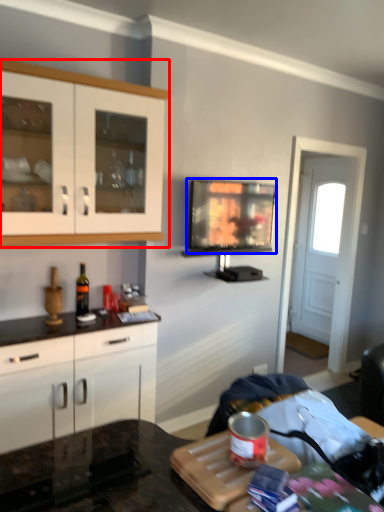
Question: Which point is closer to the camera, cabinetry (highlighted by a red box) or television (highlighted by a blue box)?

Choices:
 (A) cabinetry
 (B) television

Answer: (A)